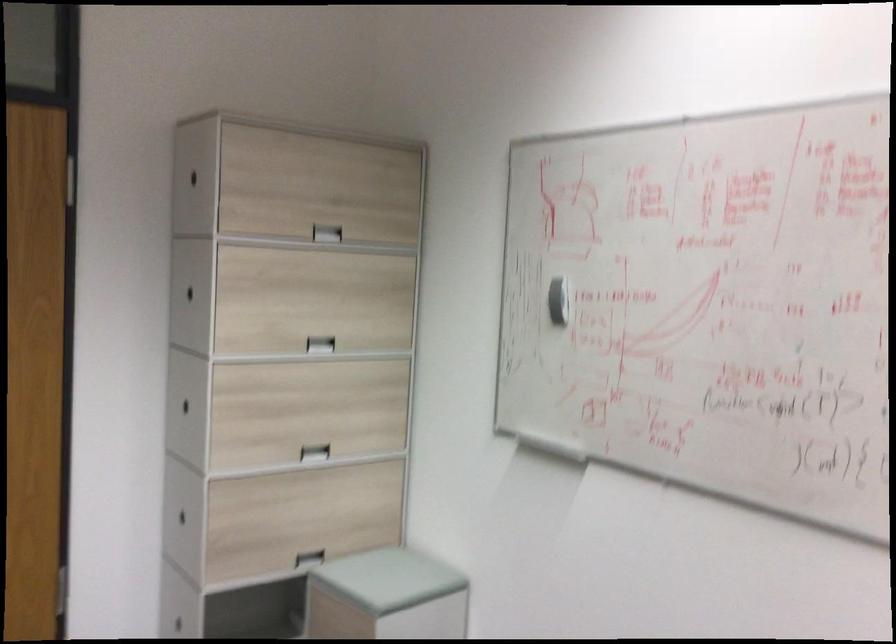
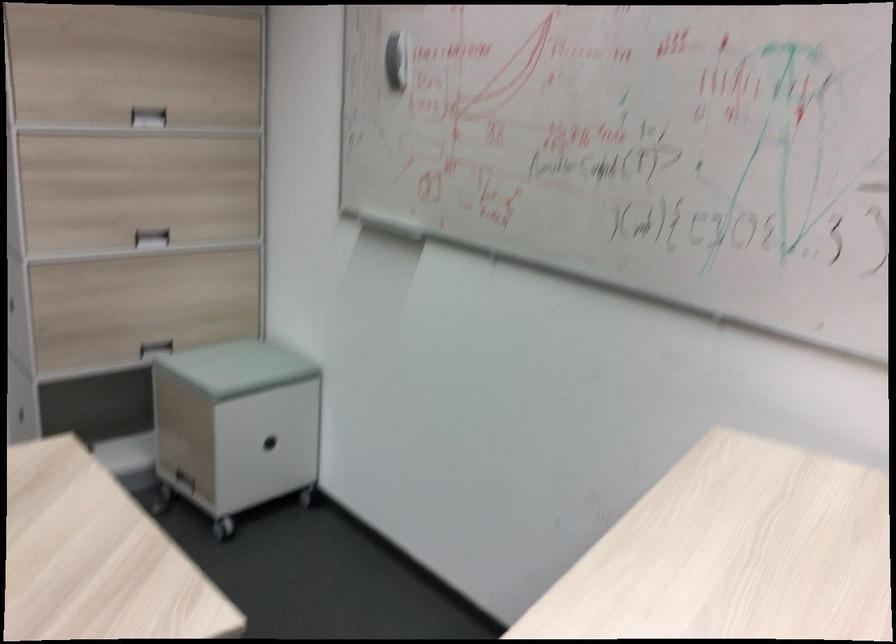
Question: Which direction would the cameraman need to move to produce the second image? Reply with the corresponding letter.

Choices:
 (A) Left
 (B) Right
 (C) Forward
 (D) Backward

Answer: (B)